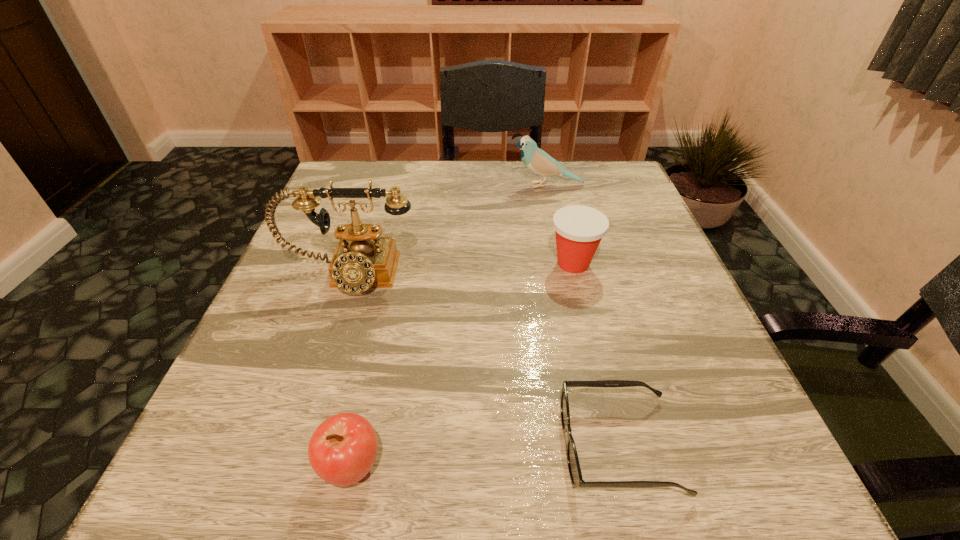
This screenshot has width=960, height=540. I want to click on Dixie cup at the right edge, so click(579, 229).

What are the coordinates of `sunglasses positioned at the right edge` in the screenshot? It's located at (577, 481).

You are a GUI agent. You are given a task and a screenshot of the screen. Output one action in this format:
    pyautogui.click(x=<x>, y=<y>)
    Task: Click on the object situated at the far right corner
    This screenshot has width=960, height=540.
    Given the screenshot: What is the action you would take?
    click(x=537, y=160)

This screenshot has width=960, height=540. I want to click on object situated at the near right corner, so click(577, 481).

You are a GUI agent. You are given a task and a screenshot of the screen. Output one action in this format:
    pyautogui.click(x=<x>, y=<y>)
    Task: Click on the free space at the far edge
    This screenshot has width=960, height=540.
    Given the screenshot: What is the action you would take?
    pyautogui.click(x=428, y=199)

In order to click on vacant area at the near edge in this screenshot , I will do click(577, 510).

In the image, there is a desktop. Identify the location of vacant space at the left edge. (304, 271).

What are the coordinates of `free location at the right edge` in the screenshot? It's located at (602, 271).

This screenshot has height=540, width=960. In the image, there is a desktop. Identify the location of vacant region at the far left corner. pos(348,178).

At what (x,y) coordinates should I click in order to perform the action: click on vacant space at the near left corner. Please return your answer as a coordinate pair (x, y). Image resolution: width=960 pixels, height=540 pixels. Looking at the image, I should click on (259, 489).